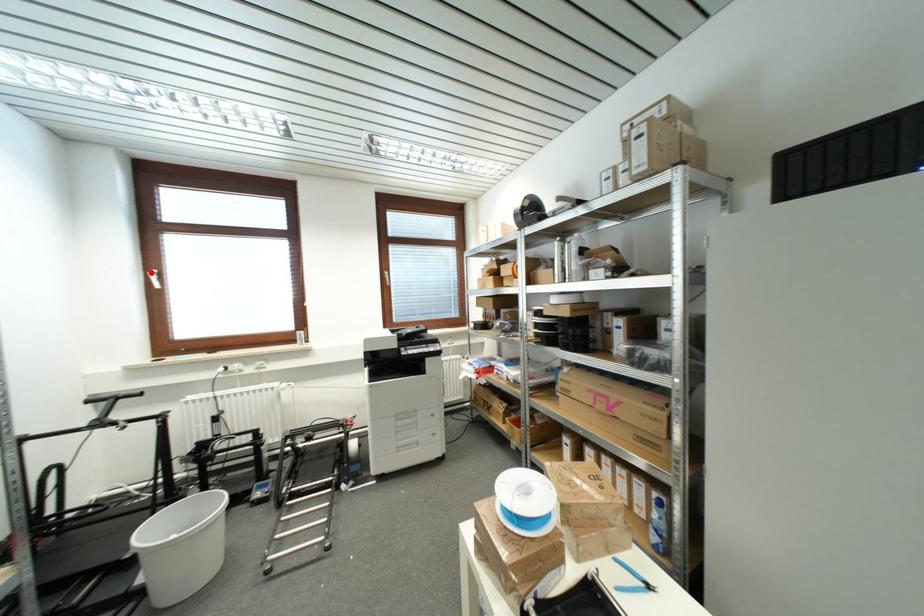
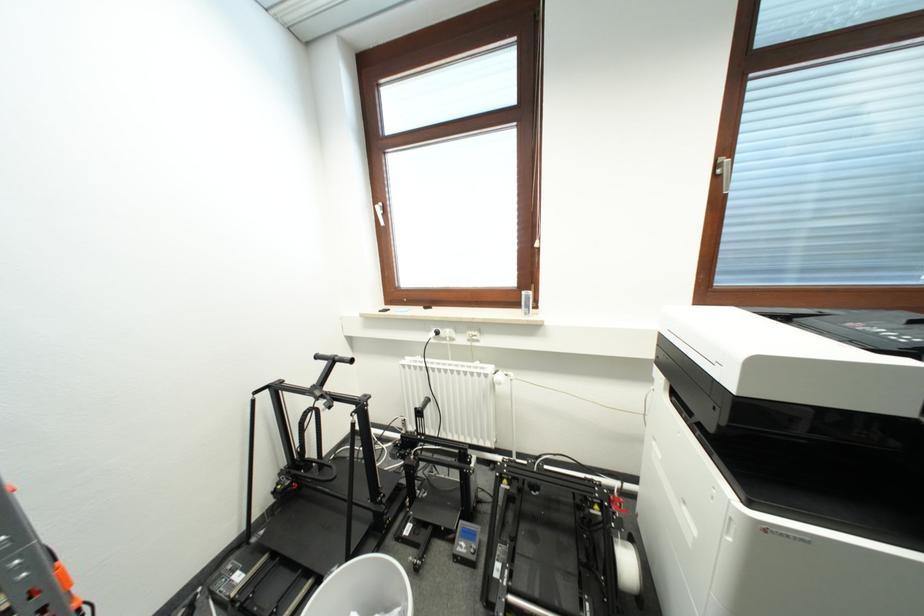
Where in the second image is the point corresponding to the highlighted location from the first image?

(379, 206)